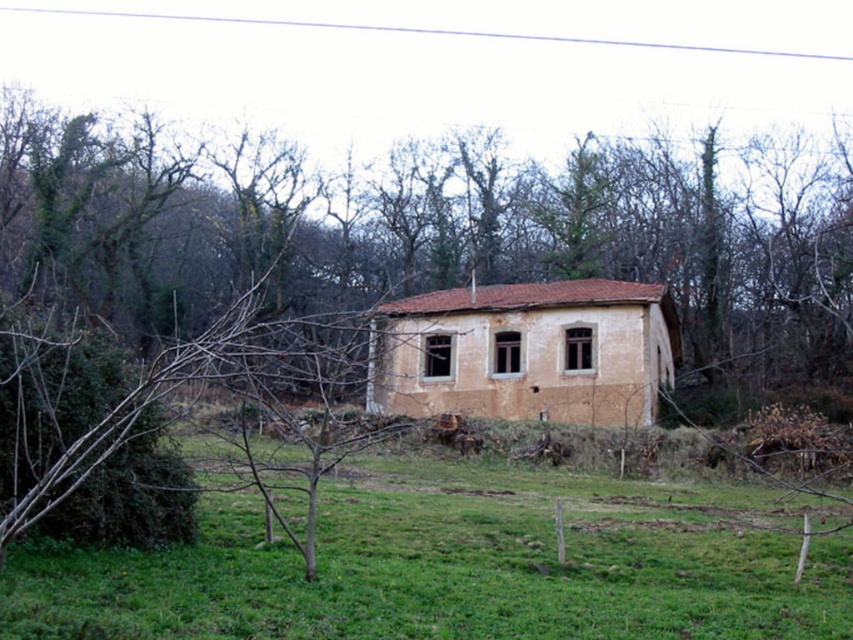
Question: Can you confirm if brown bark tree at center is smaller than green grass at center?

Choices:
 (A) no
 (B) yes

Answer: (A)

Question: Based on their relative distances, which object is nearer to the green grass at center?

Choices:
 (A) brown bark tree at center
 (B) brown textured house at center

Answer: (B)

Question: Which point is closer to the camera?

Choices:
 (A) brown textured house at center
 (B) green grass at center
 (C) brown bark tree at center

Answer: (B)

Question: Does green grass at center have a greater width compared to brown textured house at center?

Choices:
 (A) no
 (B) yes

Answer: (A)

Question: Does green grass at center lie behind brown textured house at center?

Choices:
 (A) no
 (B) yes

Answer: (A)

Question: Which point is closer to the camera taking this photo?

Choices:
 (A) (534, 493)
 (B) (514, 410)
 (C) (703, 304)

Answer: (A)